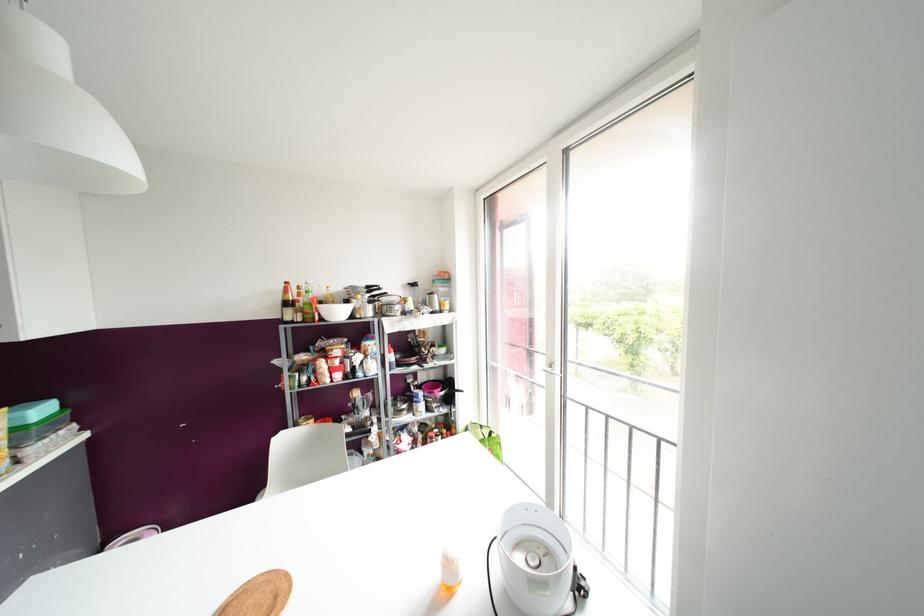
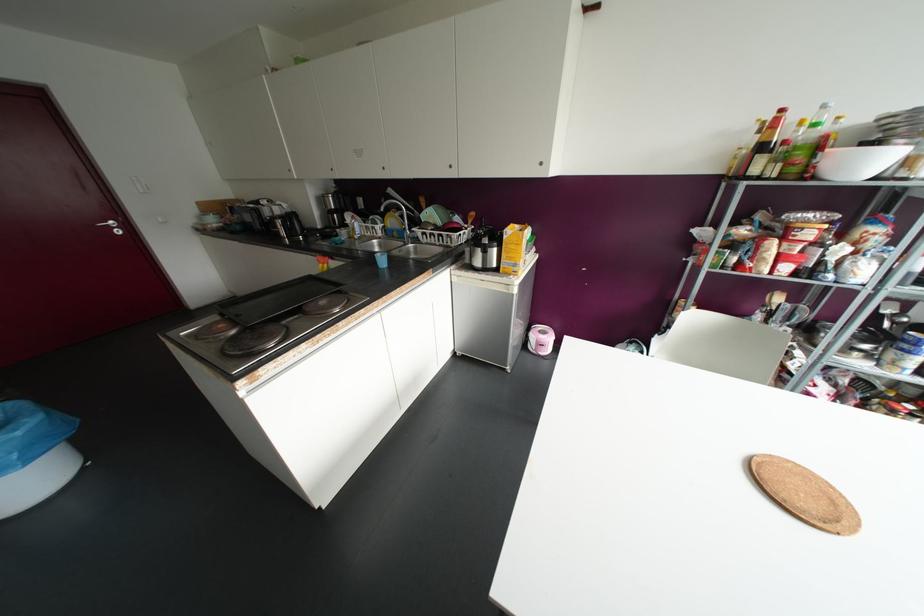
The images are taken continuously from a first-person perspective. In which direction is your viewpoint rotating?

The rotation direction of the camera is left-down.